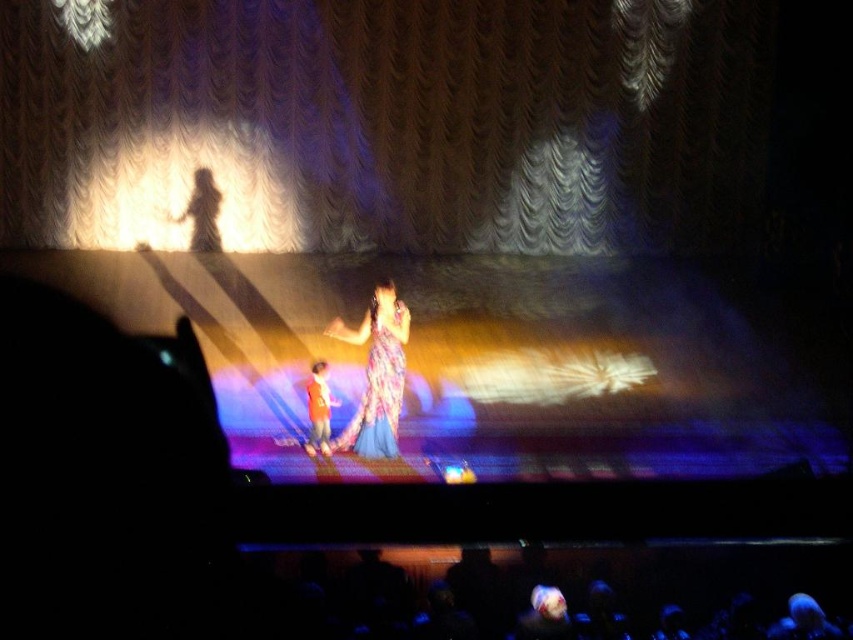
Question: Does floral chiffon dress at center come in front of orange fabric at center?

Choices:
 (A) yes
 (B) no

Answer: (A)

Question: Can you confirm if white textured curtain at upper center is thinner than floral chiffon dress at center?

Choices:
 (A) no
 (B) yes

Answer: (A)

Question: Does white textured curtain at upper center have a larger size compared to floral chiffon dress at center?

Choices:
 (A) yes
 (B) no

Answer: (A)

Question: Which is nearer to the white textured curtain at upper center?

Choices:
 (A) floral chiffon dress at center
 (B) orange fabric at center

Answer: (A)

Question: Which of these objects is positioned closest to the floral chiffon dress at center?

Choices:
 (A) white textured curtain at upper center
 (B) orange fabric at center

Answer: (B)

Question: Which point is closer to the camera?

Choices:
 (A) (577, 145)
 (B) (372, 339)
 (C) (325, 451)

Answer: (B)